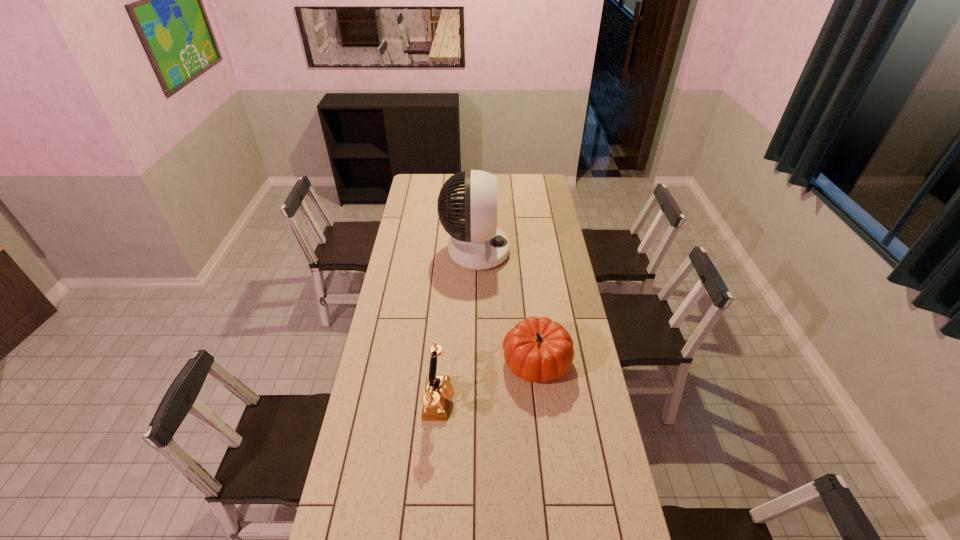
At what (x,y) coordinates should I click in order to perform the action: click on free location at the far left corner of the desktop. Please return your answer as a coordinate pair (x, y). The image size is (960, 540). Looking at the image, I should click on (428, 177).

Image resolution: width=960 pixels, height=540 pixels. Find the location of `vacant space at the far right corner of the desktop`. vacant space at the far right corner of the desktop is located at coordinates (542, 176).

Locate an element on the screen. This screenshot has width=960, height=540. empty space between the telephone and the pumpkin is located at coordinates (488, 381).

The height and width of the screenshot is (540, 960). Identify the location of free point between the telephone and the fan. (457, 326).

This screenshot has height=540, width=960. What are the coordinates of `free space between the tallest object and the pumpkin` in the screenshot? It's located at (506, 306).

Identify the location of vacant area that lies between the telephone and the pumpkin. (488, 381).

The width and height of the screenshot is (960, 540). Find the location of `blank region between the pumpkin and the telephone`. blank region between the pumpkin and the telephone is located at coordinates (488, 381).

Identify which object is the second nearest to the fan. Please provide its 2D coordinates. Your answer should be formatted as a tuple, i.e. [(x, y)], where the tuple contains the x and y coordinates of a point satisfying the conditions above.

[(438, 390)]

Locate an element on the screen. The width and height of the screenshot is (960, 540). object that is the second closest to the tallest object is located at coordinates (438, 390).

Find the location of a particular element. This screenshot has height=540, width=960. vacant space that satisfies the following two spatial constraints: 1. on the front side of the pumpkin; 2. on the dial of the telephone is located at coordinates (541, 400).